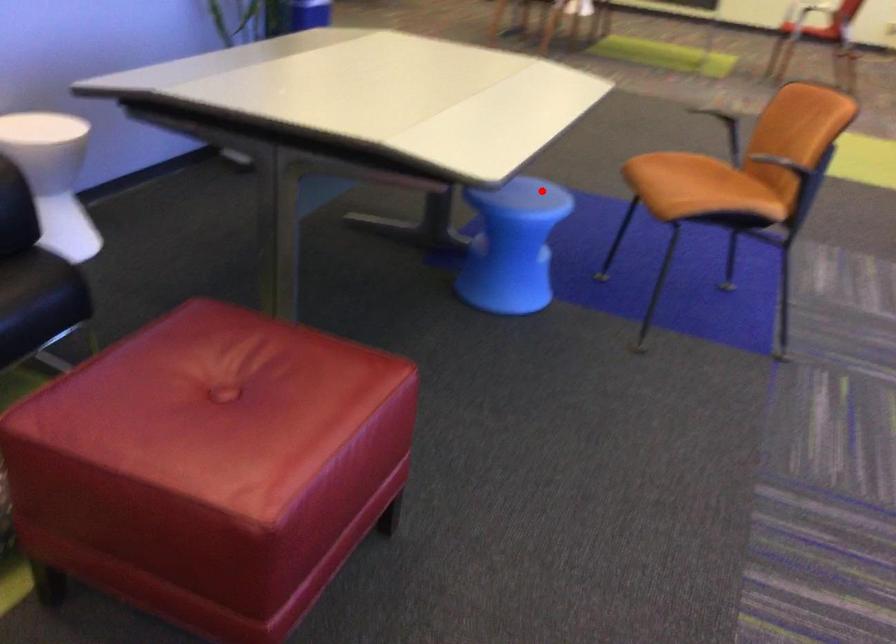
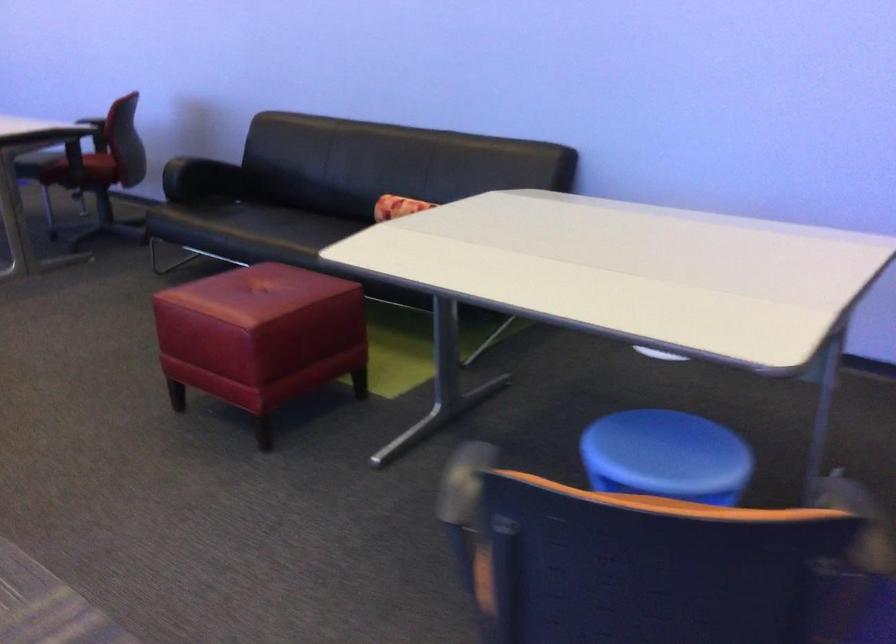
Question: A red point is marked in image1. In image2, is the corresponding 3D point closer to the camera or farther? Reply with the corresponding letter.

Choices:
 (A) The corresponding 3D point is closer.
 (B) The corresponding 3D point is farther.

Answer: (A)